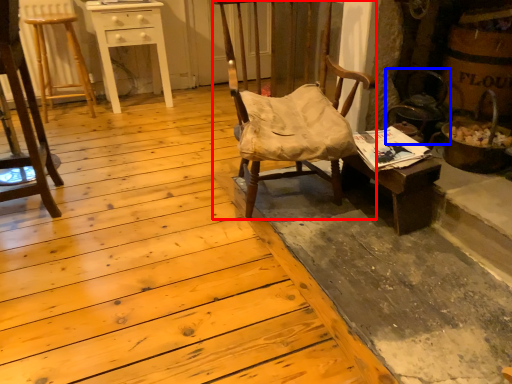
Question: Which object appears closest to the camera in this image, chair (highlighted by a red box) or swivel chair (highlighted by a blue box)?

Choices:
 (A) chair
 (B) swivel chair

Answer: (A)